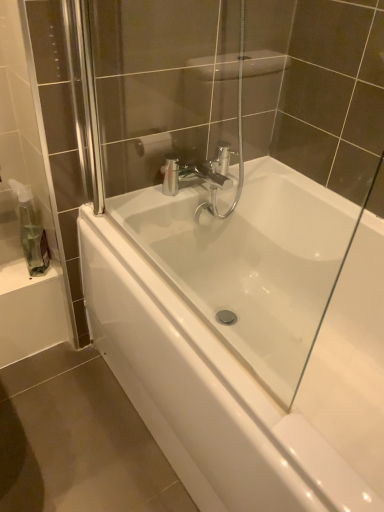
Question: Are transparent plastic soap dispenser at left and white glossy bathtub at center making contact?

Choices:
 (A) no
 (B) yes

Answer: (A)

Question: Considering the relative sizes of transparent plastic soap dispenser at left and white glossy bathtub at center in the image provided, is transparent plastic soap dispenser at left taller than white glossy bathtub at center?

Choices:
 (A) no
 (B) yes

Answer: (A)

Question: From the image's perspective, would you say transparent plastic soap dispenser at left is shown under white glossy bathtub at center?

Choices:
 (A) no
 (B) yes

Answer: (A)

Question: Is transparent plastic soap dispenser at left behind white glossy bathtub at center?

Choices:
 (A) no
 (B) yes

Answer: (B)

Question: Would you say white glossy bathtub at center is part of transparent plastic soap dispenser at left's contents?

Choices:
 (A) no
 (B) yes

Answer: (A)

Question: Does transparent plastic soap dispenser at left have a lesser width compared to white glossy bathtub at center?

Choices:
 (A) yes
 (B) no

Answer: (A)

Question: Is white glossy bathtub at center oriented towards transparent plastic soap dispenser at left?

Choices:
 (A) no
 (B) yes

Answer: (A)

Question: From the image's perspective, is white glossy bathtub at center beneath transparent plastic soap dispenser at left?

Choices:
 (A) yes
 (B) no

Answer: (A)

Question: Considering the relative positions of white glossy bathtub at center and transparent plastic soap dispenser at left in the image provided, is white glossy bathtub at center in front of transparent plastic soap dispenser at left?

Choices:
 (A) no
 (B) yes

Answer: (B)

Question: From a real-world perspective, is white glossy bathtub at center located beneath transparent plastic soap dispenser at left?

Choices:
 (A) yes
 (B) no

Answer: (A)

Question: From the image's perspective, does white glossy bathtub at center appear higher than transparent plastic soap dispenser at left?

Choices:
 (A) no
 (B) yes

Answer: (A)

Question: Is white glossy bathtub at center turned away from transparent plastic soap dispenser at left?

Choices:
 (A) yes
 (B) no

Answer: (B)

Question: From a real-world perspective, is transparent plastic soap dispenser at left physically located above or below white glossy bathtub at center?

Choices:
 (A) above
 (B) below

Answer: (A)